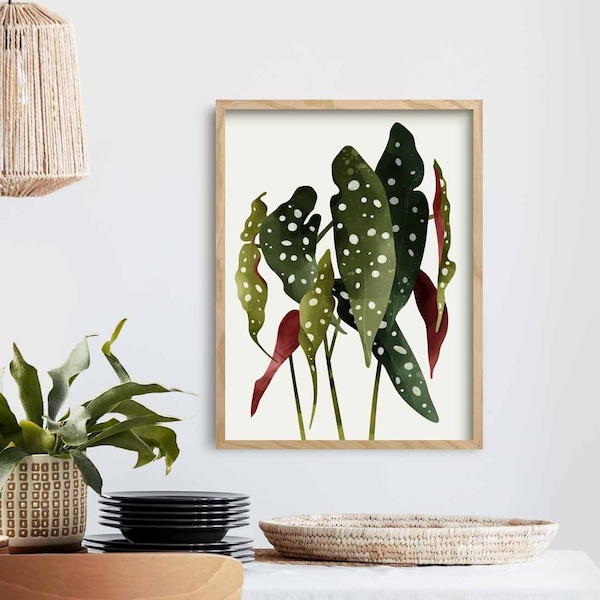
Where is `macrame`? Image resolution: width=600 pixels, height=600 pixels. macrame is located at coordinates click(54, 141).